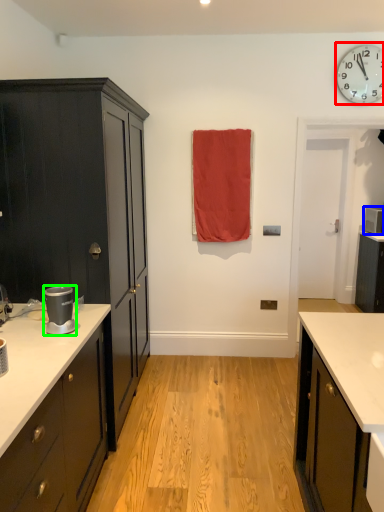
Question: Which object is positioned farthest from wall clock (highlighted by a red box)? Select from appliance (highlighted by a blue box) and appliance (highlighted by a green box).

Choices:
 (A) appliance
 (B) appliance

Answer: (B)